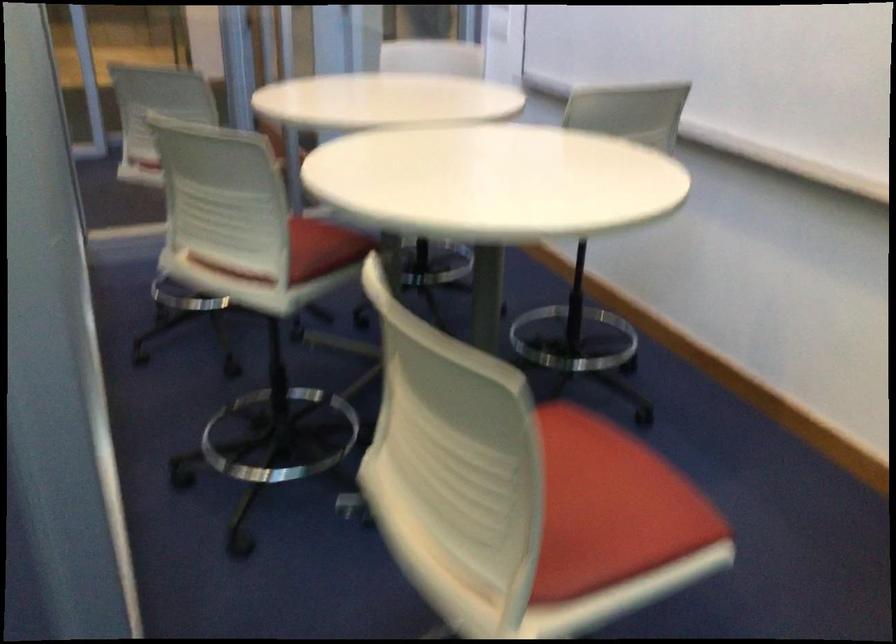
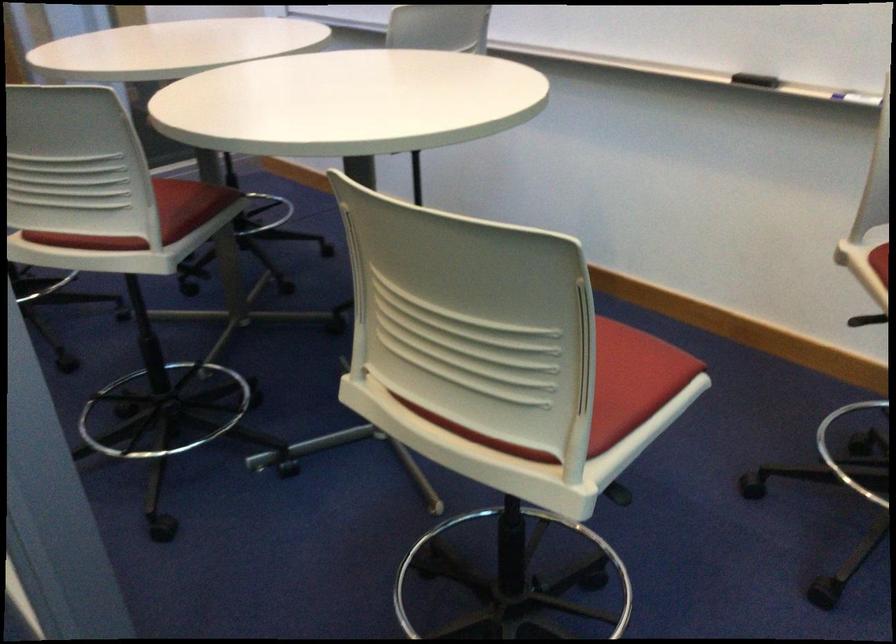
In the second image, find the point that corresponds to [633,534] in the first image.

(633, 380)